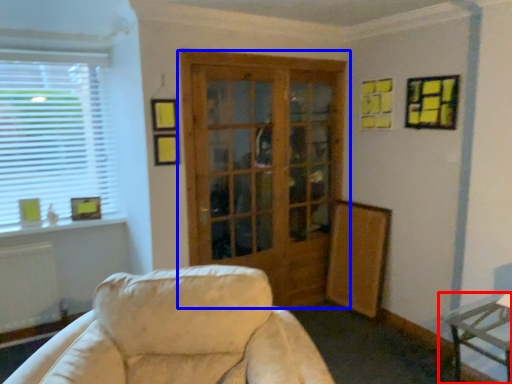
Question: Which of the following is the closest to the observer, table (highlighted by a red box) or door (highlighted by a blue box)?

Choices:
 (A) table
 (B) door

Answer: (A)